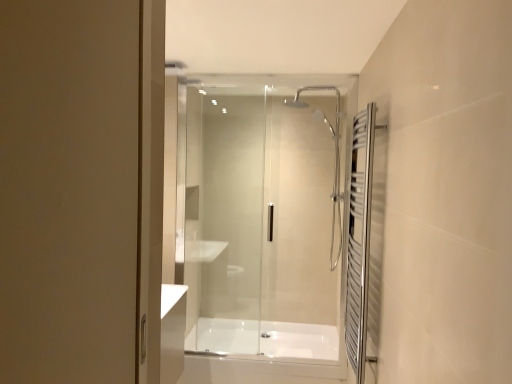
Question: Should I look upward or downward to see transparent glass shower door at center?

Choices:
 (A) down
 (B) up

Answer: (A)

Question: Considering the relative sizes of polished chrome towel rack at right and transparent glass shower door at center in the image provided, is polished chrome towel rack at right smaller than transparent glass shower door at center?

Choices:
 (A) no
 (B) yes

Answer: (B)

Question: Is the position of polished chrome towel rack at right more distant than that of transparent glass shower door at center?

Choices:
 (A) no
 (B) yes

Answer: (A)

Question: Is polished chrome towel rack at right facing away from transparent glass shower door at center?

Choices:
 (A) no
 (B) yes

Answer: (A)

Question: From a real-world perspective, is polished chrome towel rack at right positioned under transparent glass shower door at center based on gravity?

Choices:
 (A) no
 (B) yes

Answer: (B)

Question: Does polished chrome towel rack at right appear on the right side of transparent glass shower door at center?

Choices:
 (A) no
 (B) yes

Answer: (B)

Question: Can you confirm if polished chrome towel rack at right is positioned to the left of transparent glass shower door at center?

Choices:
 (A) no
 (B) yes

Answer: (A)

Question: Would you say transparent glass shower door at center contains polished chrome towel rack at right?

Choices:
 (A) no
 (B) yes

Answer: (A)

Question: Can you confirm if transparent glass shower door at center is positioned to the left of polished chrome towel rack at right?

Choices:
 (A) no
 (B) yes

Answer: (B)

Question: Considering the relative positions of transparent glass shower door at center and polished chrome towel rack at right in the image provided, is transparent glass shower door at center behind polished chrome towel rack at right?

Choices:
 (A) yes
 (B) no

Answer: (A)

Question: Is transparent glass shower door at center facing towards polished chrome towel rack at right?

Choices:
 (A) yes
 (B) no

Answer: (A)

Question: From a real-world perspective, is transparent glass shower door at center below polished chrome towel rack at right?

Choices:
 (A) no
 (B) yes

Answer: (A)

Question: Does transparent glass shower door at center touch polished chrome towel rack at right?

Choices:
 (A) no
 (B) yes

Answer: (A)

Question: Considering the relative positions of polished chrome towel rack at right and white glossy bathtub at center in the image provided, is polished chrome towel rack at right to the left of white glossy bathtub at center from the viewer's perspective?

Choices:
 (A) no
 (B) yes

Answer: (A)